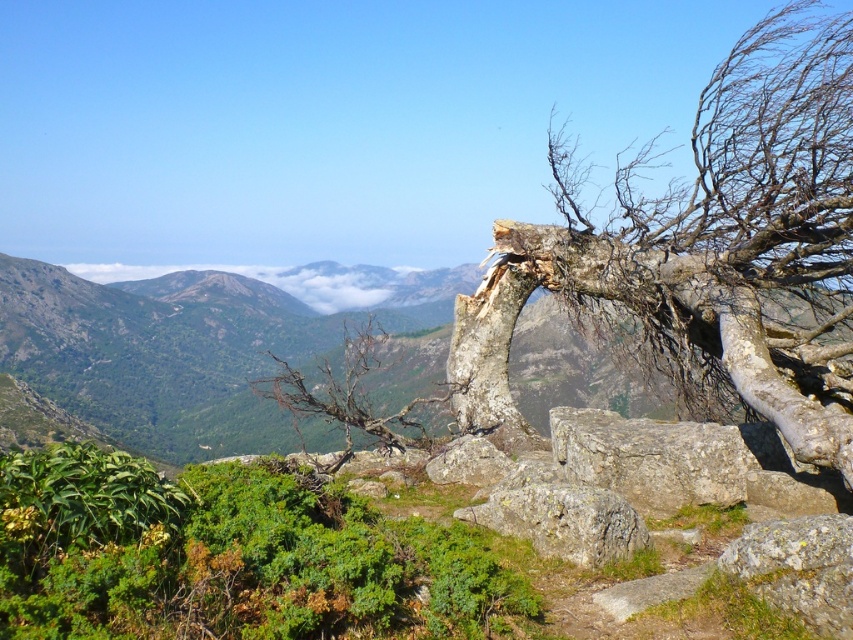
You are a hiker standing at the base of the gray rough rock at center. You notice a white fluffy cloud at center in the sky above. Which object is nearer to you?

The gray rough rock at center is closer to the viewer than the white fluffy cloud at center.